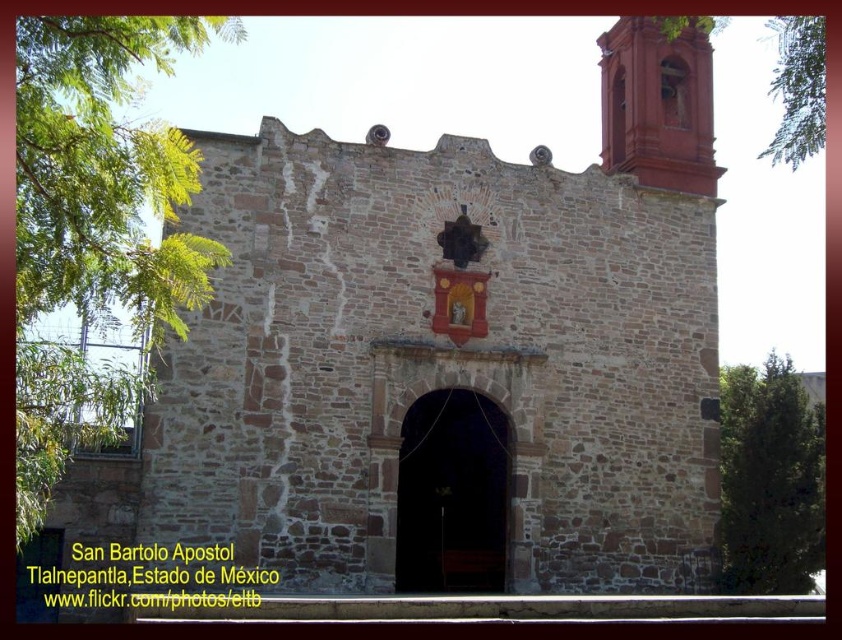
Who is positioned more to the right, brown stone chapel at center or smooth red bell tower at upper right?

smooth red bell tower at upper right

Does brown stone chapel at center appear over smooth red bell tower at upper right?

No, brown stone chapel at center is not above smooth red bell tower at upper right.

Which is in front, point (377, 476) or point (653, 49)?

Point (377, 476) is more forward.

I want to click on brown stone chapel at center, so click(457, 340).